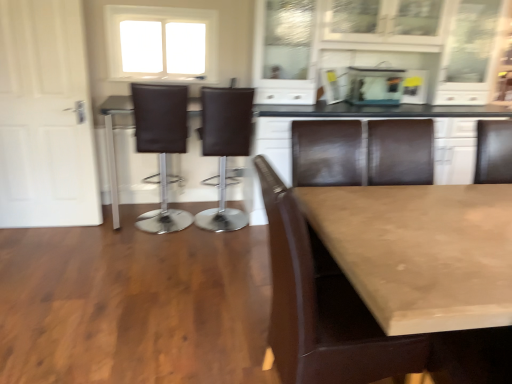
At what (x,y) coordinates should I click in order to perform the action: click on vacant area on top of white frosted glass window at upper center (from a real-world perspective). Please return your answer as a coordinate pair (x, y). Looking at the image, I should click on (158, 9).